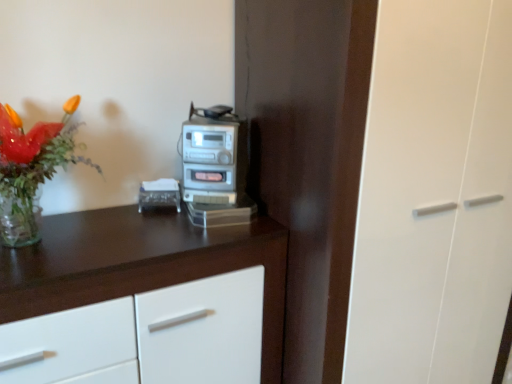
Question: Considering the relative sizes of white glossy cabinet at upper left and clear plastic tissue box at center in the image provided, is white glossy cabinet at upper left taller than clear plastic tissue box at center?

Choices:
 (A) yes
 (B) no

Answer: (A)

Question: Is clear plastic tissue box at center at the back of white glossy cabinet at upper left?

Choices:
 (A) yes
 (B) no

Answer: (B)

Question: From a real-world perspective, is white glossy cabinet at upper left on top of clear plastic tissue box at center?

Choices:
 (A) yes
 (B) no

Answer: (B)

Question: Is white glossy cabinet at upper left positioned far away from clear plastic tissue box at center?

Choices:
 (A) yes
 (B) no

Answer: (B)

Question: Is white glossy cabinet at upper left to the left of clear plastic tissue box at center from the viewer's perspective?

Choices:
 (A) no
 (B) yes

Answer: (B)

Question: Considering the positions of translucent glass vase at upper left and silver metallic stereo at center in the image, is translucent glass vase at upper left taller or shorter than silver metallic stereo at center?

Choices:
 (A) tall
 (B) short

Answer: (A)

Question: From the image's perspective, is translucent glass vase at upper left positioned above or below silver metallic stereo at center?

Choices:
 (A) below
 (B) above

Answer: (A)

Question: Based on their sizes in the image, would you say translucent glass vase at upper left is bigger or smaller than silver metallic stereo at center?

Choices:
 (A) big
 (B) small

Answer: (A)

Question: From a real-world perspective, is translucent glass vase at upper left positioned above or below silver metallic stereo at center?

Choices:
 (A) below
 (B) above

Answer: (B)

Question: From the image's perspective, is clear plastic tissue box at center located above or below white glossy cabinet at upper left?

Choices:
 (A) below
 (B) above

Answer: (B)

Question: Considering the positions of clear plastic tissue box at center and white glossy cabinet at upper left in the image, is clear plastic tissue box at center wider or thinner than white glossy cabinet at upper left?

Choices:
 (A) wide
 (B) thin

Answer: (B)

Question: Visually, is clear plastic tissue box at center positioned to the left or to the right of white glossy cabinet at upper left?

Choices:
 (A) right
 (B) left

Answer: (A)

Question: From their relative heights in the image, would you say clear plastic tissue box at center is taller or shorter than white glossy cabinet at upper left?

Choices:
 (A) tall
 (B) short

Answer: (B)

Question: From a real-world perspective, is translucent glass vase at upper left positioned above or below white glossy cabinet at upper left?

Choices:
 (A) above
 (B) below

Answer: (A)

Question: Would you say translucent glass vase at upper left is to the left or to the right of white glossy cabinet at upper left in the picture?

Choices:
 (A) right
 (B) left

Answer: (B)